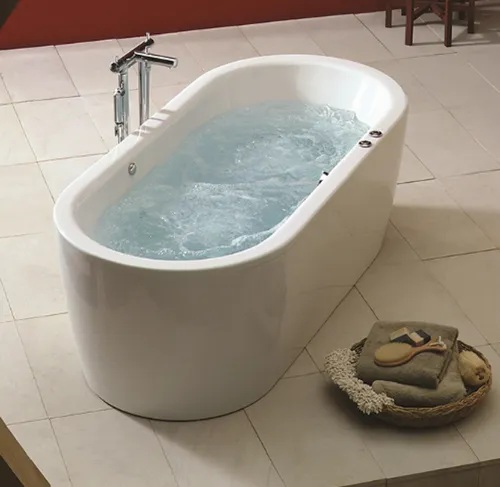
You are a GUI agent. You are given a task and a screenshot of the screen. Output one action in this format:
    pyautogui.click(x=<x>, y=<y>)
    Task: Click on the scrub brush
    This screenshot has height=487, width=500.
    Given the screenshot: What is the action you would take?
    pyautogui.click(x=391, y=354)